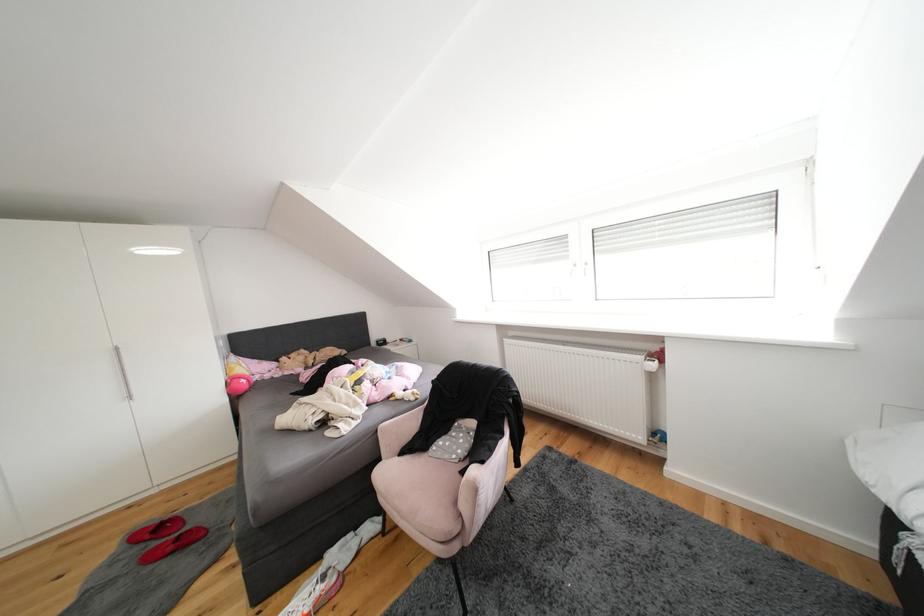
Which object does [314,592] point to?

This point indicates the white running shoe.